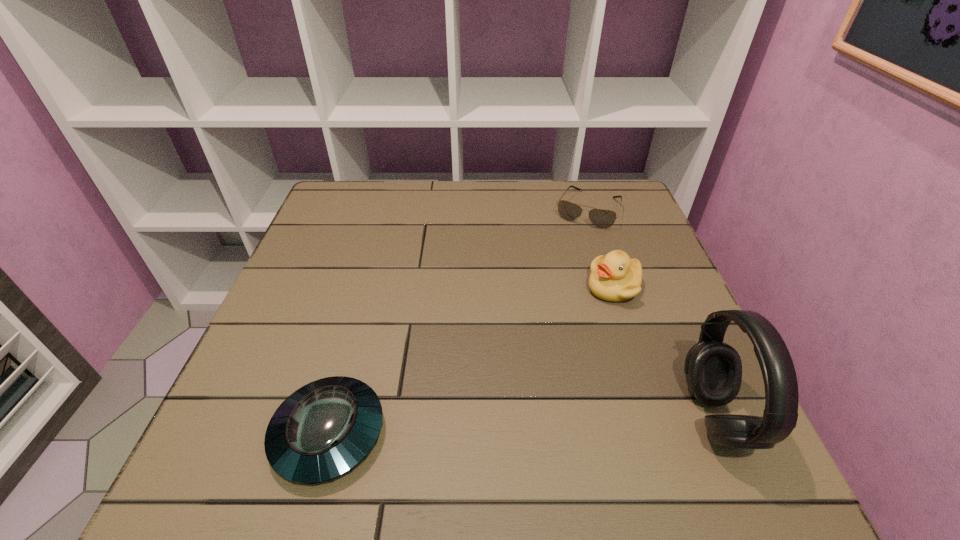
Identify the location of vacant space located 0.300m on the front-facing side of the farthest object. The width and height of the screenshot is (960, 540). (545, 302).

This screenshot has height=540, width=960. I want to click on vacant space located 0.290m on the front-facing side of the farthest object, so click(546, 299).

Where is `object that is at the far edge`? The image size is (960, 540). object that is at the far edge is located at coordinates (601, 218).

The height and width of the screenshot is (540, 960). Identify the location of saucer at the near edge. (323, 430).

Locate an element on the screen. headset present at the near edge is located at coordinates (713, 369).

At what (x,y) coordinates should I click in order to perform the action: click on object present at the left edge. Please return your answer as a coordinate pair (x, y). Image resolution: width=960 pixels, height=540 pixels. Looking at the image, I should click on 323,430.

At what (x,y) coordinates should I click in order to perform the action: click on headset situated at the right edge. Please return your answer as a coordinate pair (x, y). The width and height of the screenshot is (960, 540). Looking at the image, I should click on (713, 369).

At what (x,y) coordinates should I click in order to perform the action: click on duckling at the right edge. Please return your answer as a coordinate pair (x, y). This screenshot has width=960, height=540. Looking at the image, I should click on (615, 277).

At what (x,y) coordinates should I click in order to perform the action: click on sunglasses situated at the right edge. Please return your answer as a coordinate pair (x, y). The image size is (960, 540). Looking at the image, I should click on (601, 218).

This screenshot has width=960, height=540. What are the coordinates of `object that is at the near left corner` in the screenshot? It's located at (323, 430).